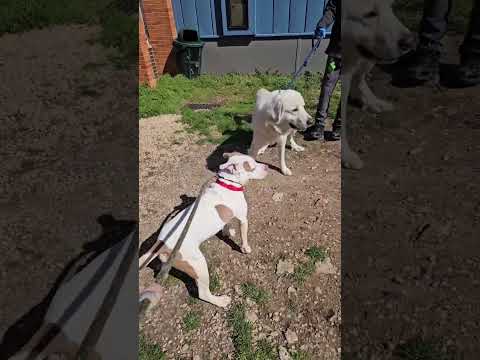
Find the location of a particular element. The width and height of the screenshot is (480, 360). green garbage pail is located at coordinates (192, 48).